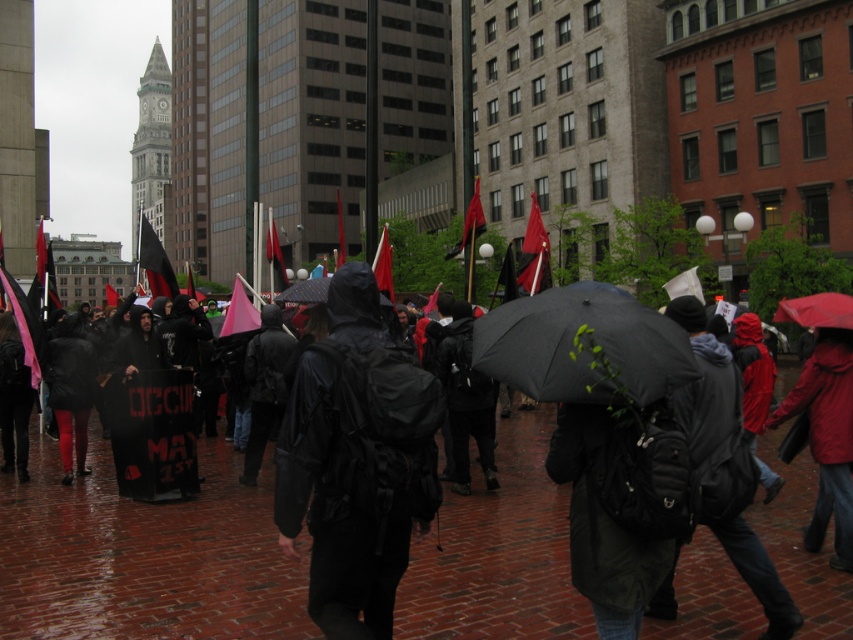
You are a photographer trying to capture a clear shot of the red fabric flag at upper center during the protest. However, there is someone wearing a black matte jacket at center blocking your view. Based on the scene description, can you adjust your position to see the flag without moving the person?

The black matte jacket at center is in front of the red fabric flag at upper center, so you can move to the side or behind the person wearing the black matte jacket at center to get an unobstructed view of the red fabric flag at upper center.

You are a photographer at the protest and want to capture a photo that includes both the black matte jacket at center and the red fabric flag at center. Based on their positions, which object should you focus on first to ensure both are in frame?

The black matte jacket at center is located below the red fabric flag at center, so you should focus on the red fabric flag at center first to ensure both are in frame.

You are a photographer standing in the crowd at the protest. You want to take a closeup photo of the black matte umbrella at center. Considering your camera can focus on objects within 5 meters, will you be able to take the photo without moving closer?

The black matte umbrella at center is 7.20 meters away from the viewer, which is beyond the camera focus range of 5 meters. Therefore, you cannot take the closeup photo without moving closer.